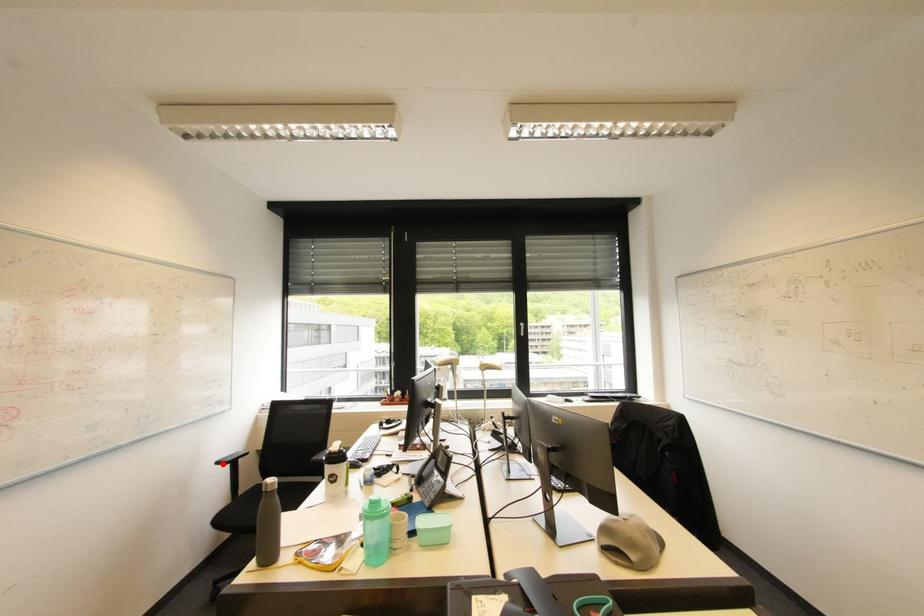
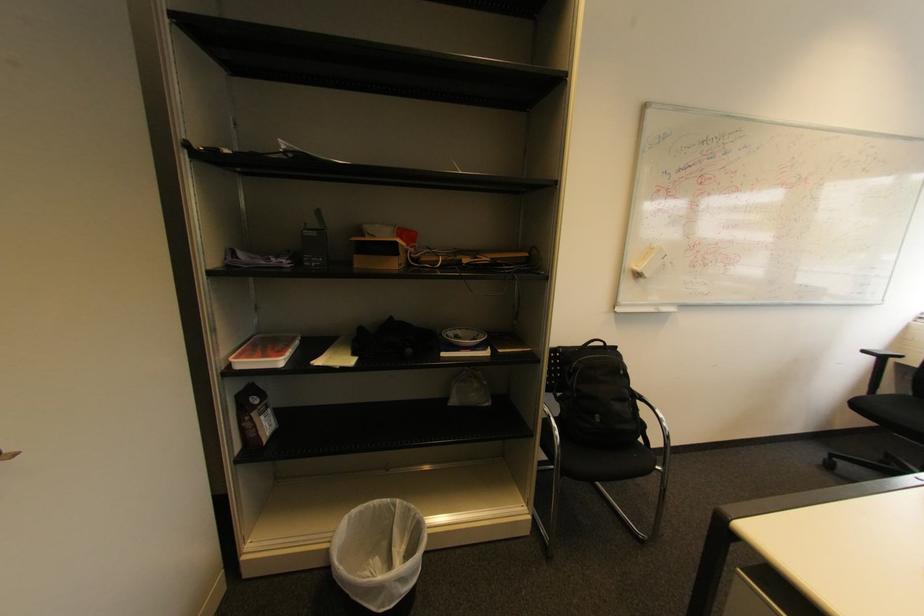
Locate, in the second image, the point that corresponds to the highlighted location in the first image.

(869, 352)